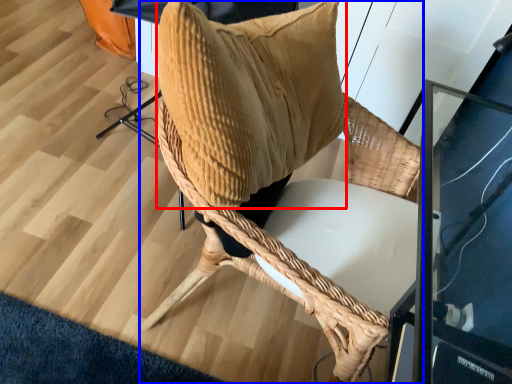
Question: Which object appears farthest to the camera in this image, pillow (highlighted by a red box) or chair (highlighted by a blue box)?

Choices:
 (A) pillow
 (B) chair

Answer: (B)